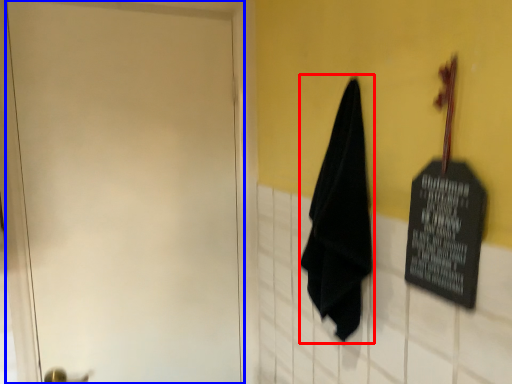
Question: Which point is closer to the camera, cloth (highlighted by a red box) or door (highlighted by a blue box)?

Choices:
 (A) cloth
 (B) door

Answer: (A)